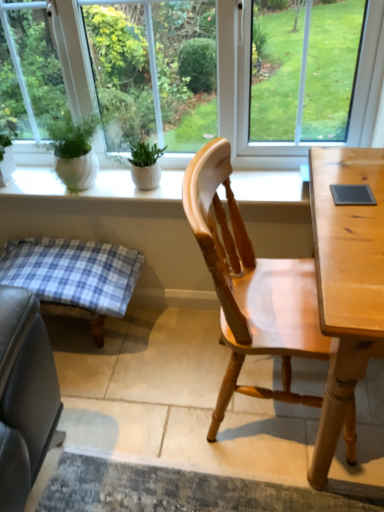
Locate an element on the screen. free location to the left of green matte plant at center is located at coordinates (103, 183).